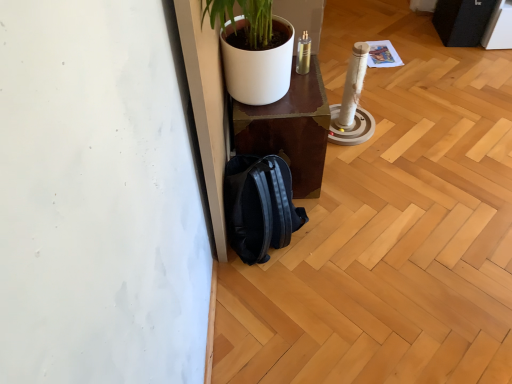
You are a GUI agent. You are given a task and a screenshot of the screen. Output one action in this format:
    pyautogui.click(x=<x>, y=<y>)
    Task: Click on the free area in between shiny brown table at center and black matte backpack at lower center
    The height and width of the screenshot is (384, 512).
    Given the screenshot: What is the action you would take?
    pyautogui.click(x=317, y=226)